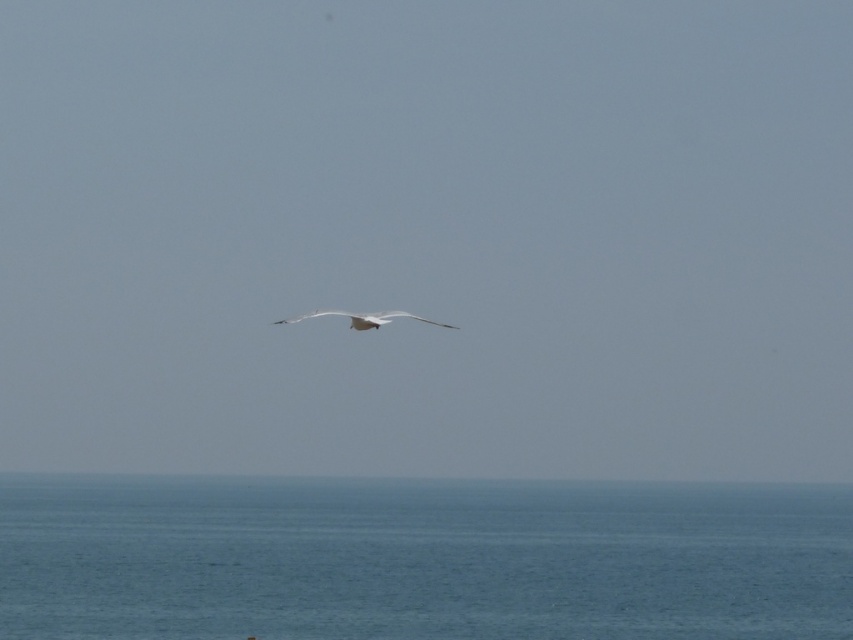
Can you confirm if blue water at lower center is thinner than white feathered bird at center?

No.

Does point (840, 579) come in front of point (361, 321)?

No, (840, 579) is behind (361, 321).

Locate an element on the screen. blue water at lower center is located at coordinates (421, 561).